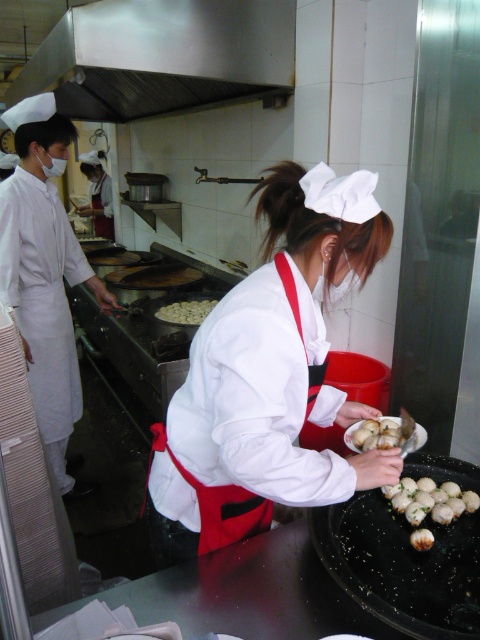
Question: Among these objects, which one is nearest to the camera?

Choices:
 (A) white matte dumplings at center
 (B) stainless steel exhaust hood at upper center
 (C) smooth white mushroom at lower right
 (D) white glossy mushrooms at center

Answer: (C)

Question: Does white glossy dumplings at center come in front of smooth white mushroom at lower right?

Choices:
 (A) yes
 (B) no

Answer: (B)

Question: Does stainless steel exhaust hood at upper center appear over white matte dumplings at center?

Choices:
 (A) yes
 (B) no

Answer: (A)

Question: Which of the following is the farthest from the observer?

Choices:
 (A) white matte dumplings at center
 (B) smooth white mushroom at lower right

Answer: (A)

Question: Estimate the real-world distances between objects in this image. Which object is closer to the white glossy dumplings at center?

Choices:
 (A) white matte dumplings at center
 (B) smooth white mushroom at lower right
 (C) white matte apron at center
 (D) white glossy mushrooms at center

Answer: (B)

Question: Does stainless steel exhaust hood at upper center have a larger size compared to white matte dumplings at center?

Choices:
 (A) yes
 (B) no

Answer: (A)